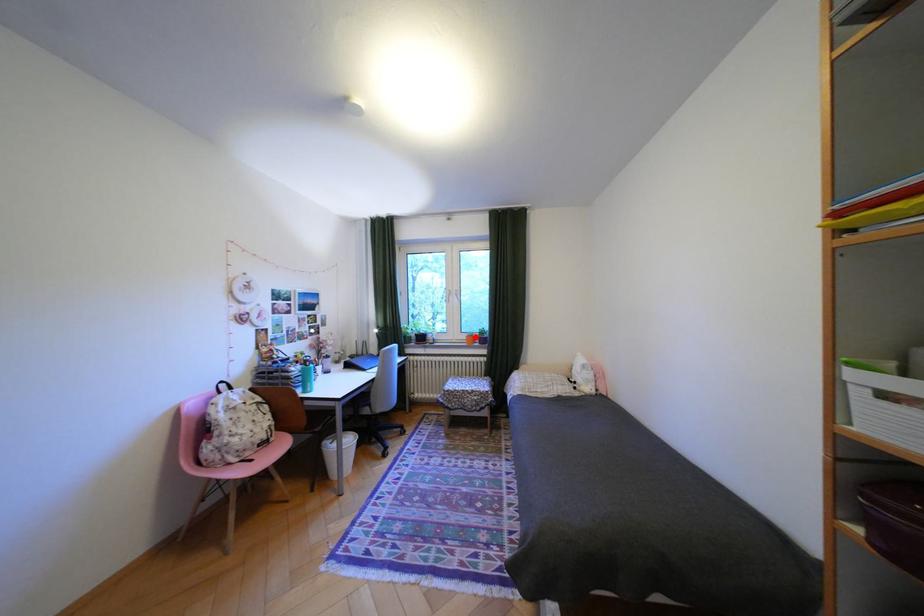
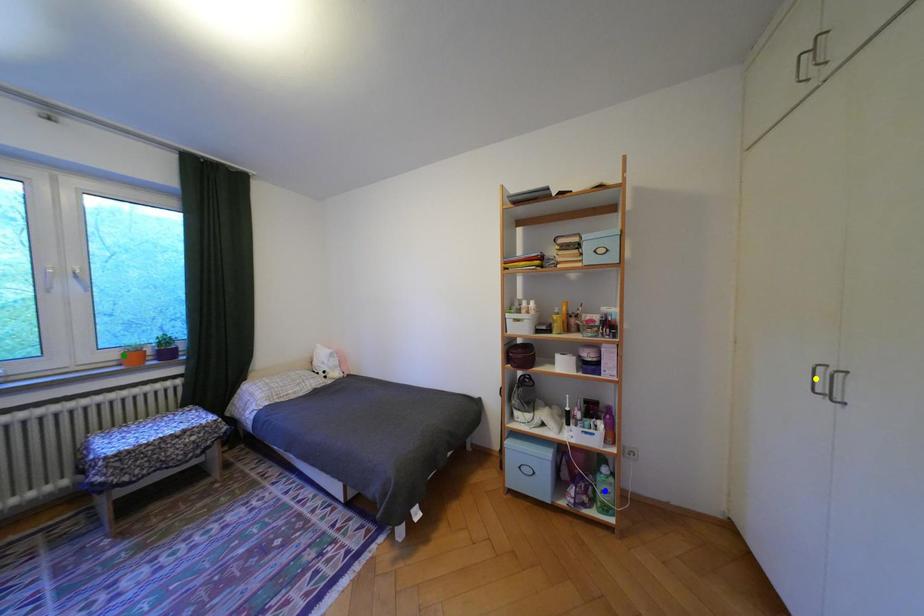
Question: I am providing you with two images of the same scene from different viewpoints. A red point is marked on the first image. You are given multiple points on the second image. Which mark in image 2 goes with the point in image 1?

Choices:
 (A) green point
 (B) yellow point
 (C) blue point

Answer: (A)